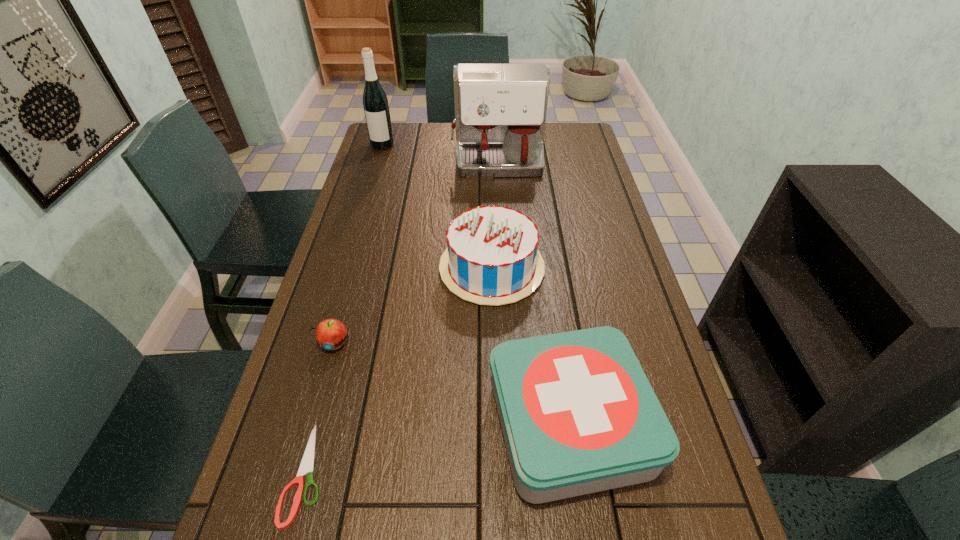
Where is `wine bottle`? wine bottle is located at coordinates (375, 103).

You are a GUI agent. You are given a task and a screenshot of the screen. Output one action in this format:
    pyautogui.click(x=<x>, y=<y>)
    Task: Click on the coffee maker
    This screenshot has height=540, width=960.
    Given the screenshot: What is the action you would take?
    pyautogui.click(x=500, y=109)

Where is `the third tallest object`? the third tallest object is located at coordinates (491, 258).

This screenshot has width=960, height=540. I want to click on birthday cake, so click(x=491, y=258).

Identify the location of the fourth tallest object. 578,415.

This screenshot has width=960, height=540. In order to click on the fifth tallest object in this screenshot , I will do `click(330, 334)`.

Identify the location of the third nearest object. (330, 334).

Find the location of a particular element. The height and width of the screenshot is (540, 960). the shortest object is located at coordinates (307, 464).

Locate an element on the screen. This screenshot has width=960, height=540. vacant space located on the label of the wine bottle is located at coordinates (367, 197).

The image size is (960, 540). Identify the location of vacant space located on the front of the coffee maker near the spout. (503, 271).